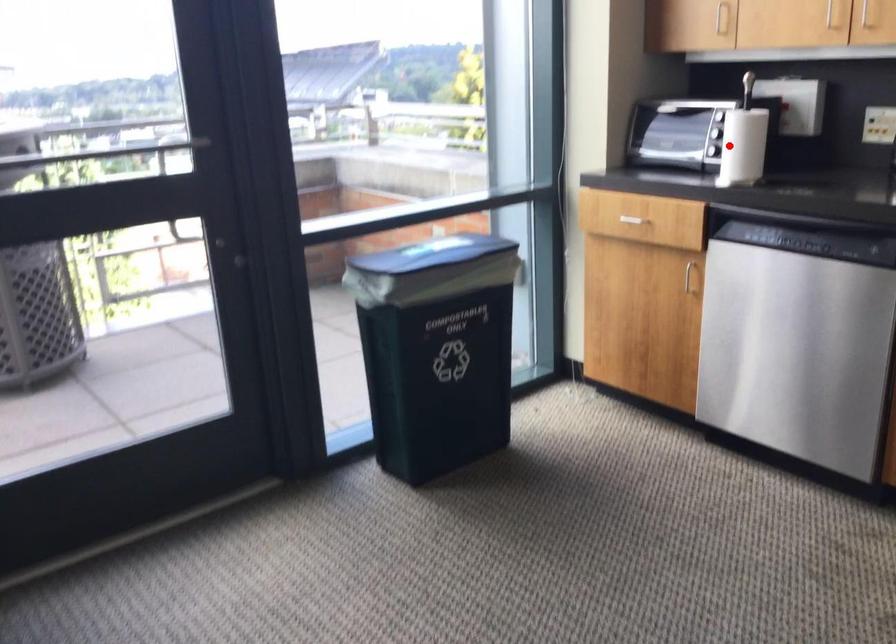
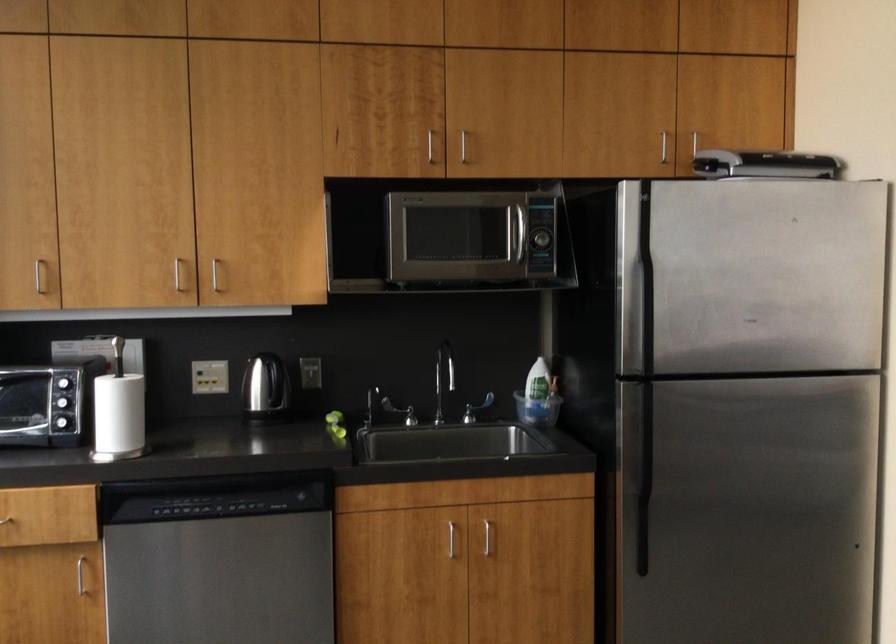
The point at the highlighted location is marked in the first image. Where is the corresponding point in the second image?

(117, 415)